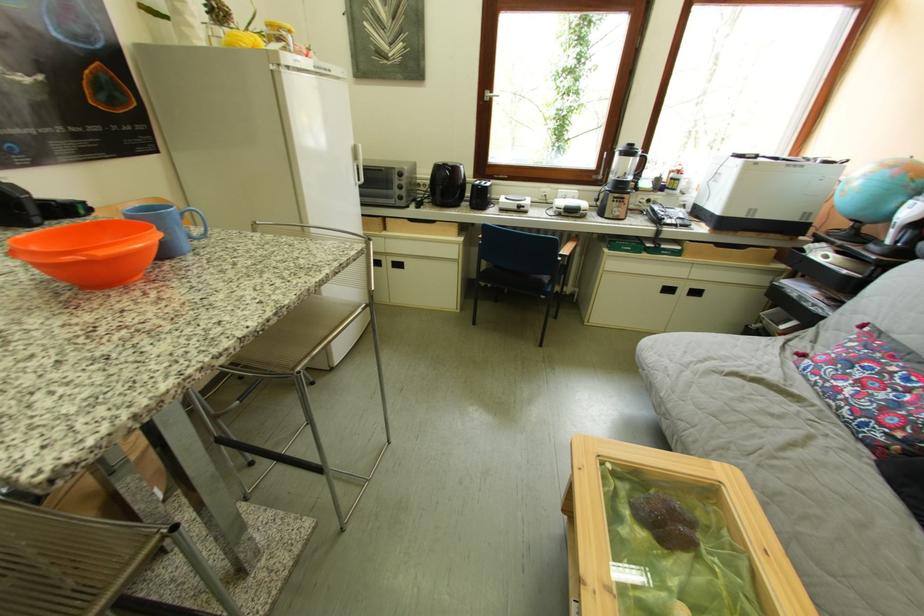
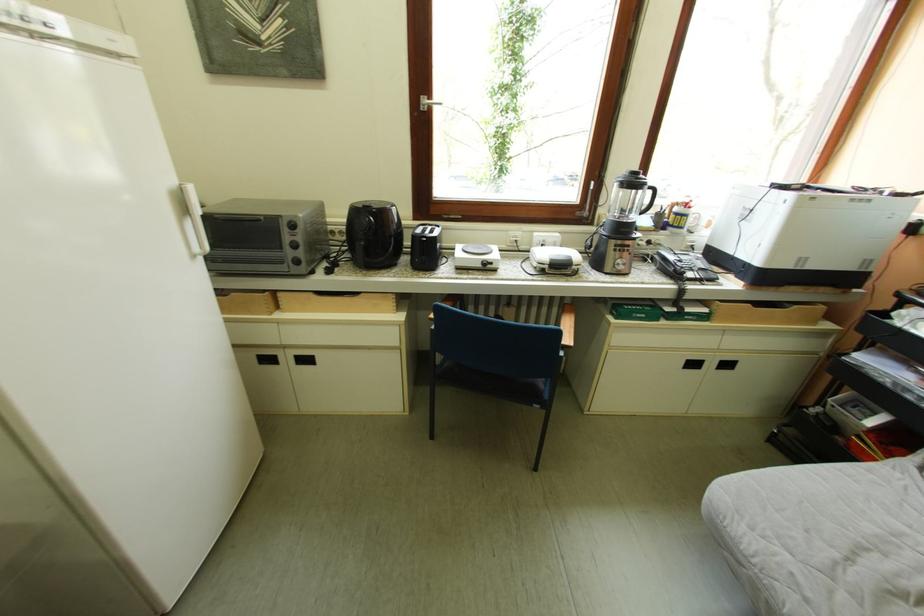
Question: Which direction would the cameraman need to move to produce the second image? Reply with the corresponding letter.

Choices:
 (A) Left
 (B) Right
 (C) Forward
 (D) Backward

Answer: (C)